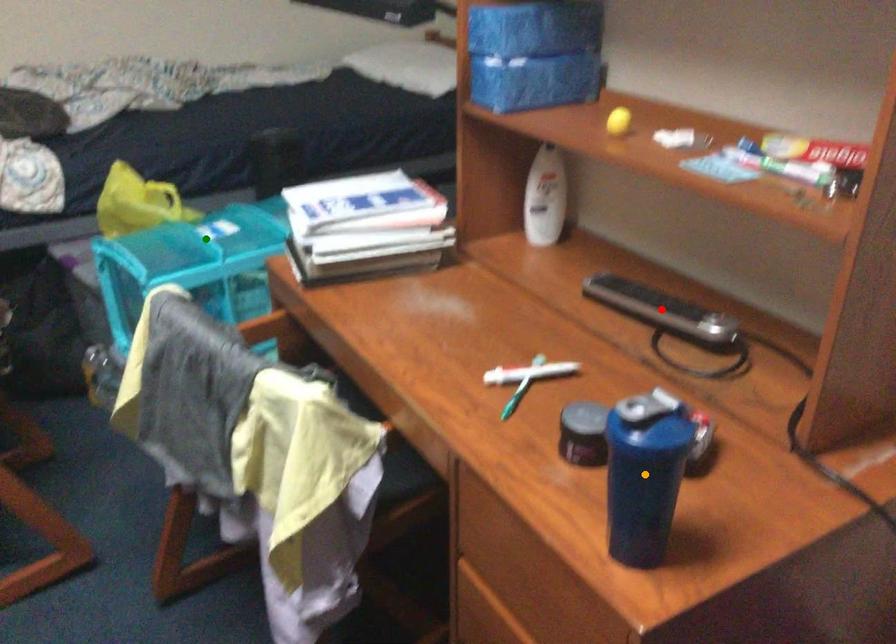
Order these from farthest to nearest:
orange point, red point, green point

green point → red point → orange point